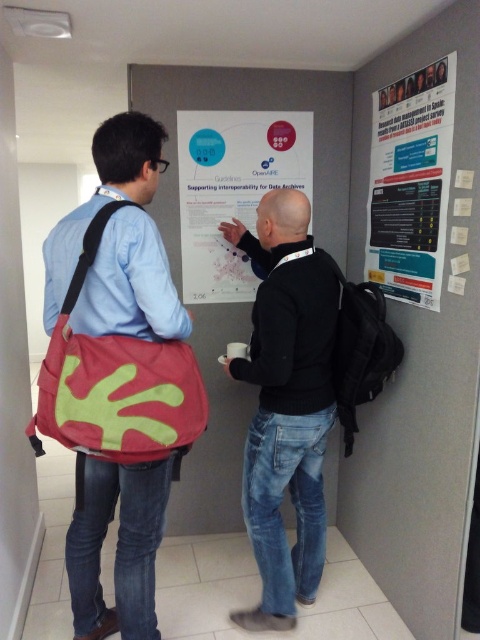
You are standing in the room and want to read the matte paper poster at center clearly. If your eyes can focus on objects as close as 0.5 meters, what is the minimum distance you should stand from the poster to read it comfortably?

The matte paper poster at center is 2.49 meters away from the camera. Since your eyes can focus as close as 0.5 meters, you should stand at least 0.5 meters away from the poster to read it comfortably.

You are an event organizer who needs to hang a new poster that is the same size as the matte paper poster at center. You have a space available next to the black matte jacket at center. Will the new poster fit in that space?

The black matte jacket at center is larger in size than the matte paper poster at center, so the space next to it may be sufficient for the new poster of the same size as the matte paper poster at center, provided there is enough room. However, since the jacket is bigger, the available space might be narrower than expected. It would depend on the exact dimensions of both the jacket and the poster.